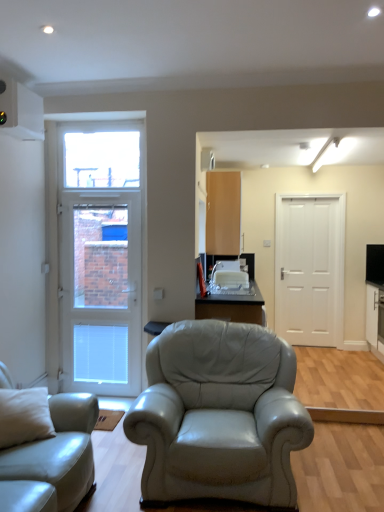
What do you see at coordinates (96, 255) in the screenshot? I see `white glossy door at left, the first door when ordered from front to back` at bounding box center [96, 255].

Measure the distance between point (27, 480) and camera.

Point (27, 480) and camera are 6.42 feet apart.

Image resolution: width=384 pixels, height=512 pixels. I want to click on light beige leather couch at lower left, so click(x=58, y=453).

Identify the location of white glossy door at left, the first door when ordered from front to back. Image resolution: width=384 pixels, height=512 pixels. (96, 255).

Is transparent glass window at upper left next to light beige leather couch at lower left?

transparent glass window at upper left is not next to light beige leather couch at lower left, and they're not touching.

Can we say transparent glass window at upper left lies outside light beige leather couch at lower left?

transparent glass window at upper left is positioned outside light beige leather couch at lower left.

Considering the relative sizes of transparent glass window at upper left and light beige leather couch at lower left in the image provided, is transparent glass window at upper left bigger than light beige leather couch at lower left?

Actually, transparent glass window at upper left might be smaller than light beige leather couch at lower left.

Considering the sizes of objects transparent glass window at upper left and light beige leather couch at lower left in the image provided, who is wider, transparent glass window at upper left or light beige leather couch at lower left?

With larger width is light beige leather couch at lower left.

Considering the sizes of white glossy door at left, the 2th door viewed from the right, and matte black table at center in the image, is white glossy door at left, the 2th door viewed from the right, taller or shorter than matte black table at center?

white glossy door at left, the 2th door viewed from the right, is taller than matte black table at center.

Which is more to the right, white glossy door at left, acting as the 2th door starting from the back, or matte black table at center?

From the viewer's perspective, matte black table at center appears more on the right side.

Which is behind, point (71, 296) or point (195, 318)?

The point (71, 296) is more distant.

This screenshot has height=512, width=384. I want to click on door lying on the left of matte black table at center, so click(x=96, y=255).

Considering the sizes of objects white matte door at right, which is the 1th door in right-to-left order, and transparent glass window at upper left in the image provided, who is smaller, white matte door at right, which is the 1th door in right-to-left order, or transparent glass window at upper left?

Smaller between the two is transparent glass window at upper left.

Is white matte door at right, which is the 2th door in left-to-right order, to the right of transparent glass window at upper left from the viewer's perspective?

Indeed, white matte door at right, which is the 2th door in left-to-right order, is positioned on the right side of transparent glass window at upper left.

Based on the photo, who is more distant, white matte door at right, the 1th door positioned from the back, or transparent glass window at upper left?

white matte door at right, the 1th door positioned from the back, is behind.

Can you tell me how much transparent glass window at upper left and matte wood cabinet at upper center differ in facing direction?

90.7 degrees separate the facing orientations of transparent glass window at upper left and matte wood cabinet at upper center.

From the image's perspective, is transparent glass window at upper left below matte wood cabinet at upper center?

Incorrect, from the image's perspective, transparent glass window at upper left is higher than matte wood cabinet at upper center.

Which is more to the right, transparent glass window at upper left or matte wood cabinet at upper center?

Positioned to the right is matte wood cabinet at upper center.

Which is nearer, (131,170) or (227,254)?

Point (131,170).

Is white glossy cabinet at right oriented towards matte black table at center?

No.

In the image, is white glossy cabinet at right positioned in front of or behind matte black table at center?

white glossy cabinet at right is positioned farther from the viewer than matte black table at center.

Choose the correct answer: Is white glossy cabinet at right inside matte black table at center or outside it?

white glossy cabinet at right is located beyond the bounds of matte black table at center.

The width and height of the screenshot is (384, 512). What are the coordinates of `table that is above the white glossy cabinet at right (from a real-world perspective)` in the screenshot? It's located at (232, 307).

What's the angular difference between white glossy cabinet at right and transparent glass window at upper left's facing directions?

white glossy cabinet at right and transparent glass window at upper left are facing 91.6 degrees away from each other.

Measure the distance between white glossy cabinet at right and transparent glass window at upper left.

They are 3.41 meters apart.

I want to click on entertainment center below the transparent glass window at upper left (from the image's perspective), so pos(375,298).

From a real-world perspective, between white glossy cabinet at right and transparent glass window at upper left, who is vertically lower?

white glossy cabinet at right is physically lower.

Which object is more forward, light beige leather couch at lower left or white glossy door at left, which is counted as the 1th door, starting from the left?

light beige leather couch at lower left is in front.

From the picture: Based on their positions, is light beige leather couch at lower left located to the left or right of white glossy door at left, the 2th door viewed from the right?

light beige leather couch at lower left is positioned on white glossy door at left, the 2th door viewed from the right,'s left side.

Find the location of a particular element. The height and width of the screenshot is (512, 384). studio couch that appears below the transparent glass window at upper left (from a real-world perspective) is located at coordinates (58, 453).

At what (x,y) coordinates should I click in order to perform the action: click on table in front of the white glossy door at left, which is counted as the 1th door, starting from the left. Please return your answer as a coordinate pair (x, y). The width and height of the screenshot is (384, 512). Looking at the image, I should click on (232, 307).

Which object lies nearer to the anchor point light beige leather couch at lower left, white glossy cabinet at right or white glossy door at left, the first door when ordered from front to back?

white glossy door at left, the first door when ordered from front to back.

Based on their spatial positions, is transparent glass window at upper left or matte black table at center further from matte wood cabinet at upper center?

matte black table at center is positioned further to the anchor matte wood cabinet at upper center.

Based on their spatial positions, is white glossy door at left, which is counted as the 1th door, starting from the left, or transparent glass window at upper left further from matte wood cabinet at upper center?

Among the two, white glossy door at left, which is counted as the 1th door, starting from the left, is located further to matte wood cabinet at upper center.

Looking at the image, which one is located further to white matte door at right, which is the 2th door in left-to-right order, light beige leather couch at lower left or white glossy cabinet at right?

light beige leather couch at lower left lies further to white matte door at right, which is the 2th door in left-to-right order, than the other object.

Estimate the real-world distances between objects in this image. Which object is further from matte black table at center, white glossy door at left, acting as the 2th door starting from the back, or white glossy cabinet at right?

white glossy cabinet at right is further to matte black table at center.

Considering their positions, is white matte door at right, which is the 1th door in right-to-left order, positioned closer to white glossy door at left, the 2th door viewed from the right, than matte wood cabinet at upper center?

matte wood cabinet at upper center is positioned closer to the anchor white glossy door at left, the 2th door viewed from the right.

Estimate the real-world distances between objects in this image. Which object is further from transparent glass window at upper left, light beige leather couch at lower left or matte black table at center?

Based on the image, light beige leather couch at lower left appears to be further to transparent glass window at upper left.

Looking at the image, which one is located further to matte black table at center, light beige leather couch at lower left or transparent glass window at upper left?

transparent glass window at upper left is positioned further to the anchor matte black table at center.

This screenshot has height=512, width=384. Find the location of `window situated between white glossy door at left, which is counted as the 1th door, starting from the left, and white matte door at right, the 1th door positioned from the back, from left to right`. window situated between white glossy door at left, which is counted as the 1th door, starting from the left, and white matte door at right, the 1th door positioned from the back, from left to right is located at coordinates (101, 156).

Where is `door between light beige leather couch at lower left and matte wood cabinet at upper center in the front-back direction`? The width and height of the screenshot is (384, 512). door between light beige leather couch at lower left and matte wood cabinet at upper center in the front-back direction is located at coordinates (96, 255).

Where is `cabinetry located between matte black table at center and white matte door at right, which is the 1th door in right-to-left order, in the depth direction`? Image resolution: width=384 pixels, height=512 pixels. cabinetry located between matte black table at center and white matte door at right, which is the 1th door in right-to-left order, in the depth direction is located at coordinates (223, 213).

At what (x,y) coordinates should I click in order to perform the action: click on cabinetry situated between matte black table at center and white glossy cabinet at right from left to right. Please return your answer as a coordinate pair (x, y). Looking at the image, I should click on (223, 213).